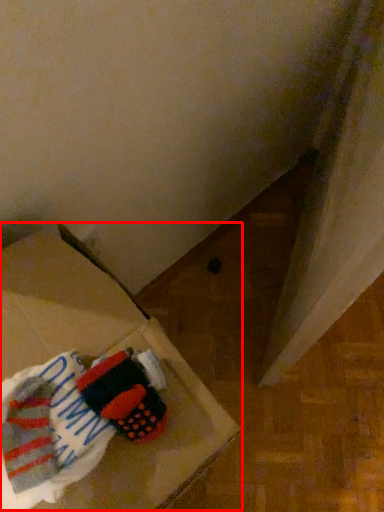
Question: Considering the relative positions of cardboard box (annotated by the red box) and laundry in the image provided, where is cardboard box (annotated by the red box) located with respect to the staircase?

Choices:
 (A) left
 (B) right

Answer: (A)